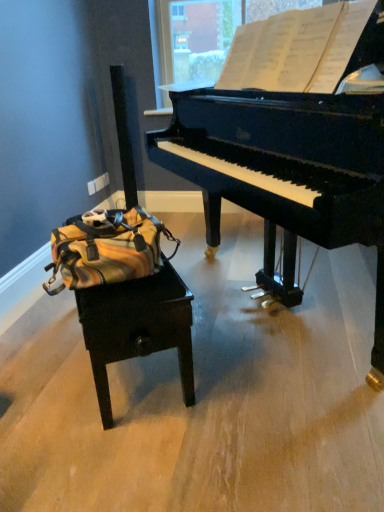
Question: Do you think black polished piano at upper right is within yellow striped fabric messenger bag at left, or outside of it?

Choices:
 (A) outside
 (B) inside

Answer: (A)

Question: Considering the positions of black polished piano at upper right and yellow striped fabric messenger bag at left in the image, is black polished piano at upper right taller or shorter than yellow striped fabric messenger bag at left?

Choices:
 (A) tall
 (B) short

Answer: (A)

Question: Which object is positioned farthest from the wooden table at lower left?

Choices:
 (A) yellow striped fabric messenger bag at left
 (B) white paper at upper center
 (C) black polished piano at upper right

Answer: (B)

Question: Which of these objects is positioned closest to the black polished piano at upper right?

Choices:
 (A) yellow striped fabric messenger bag at left
 (B) white paper at upper center
 (C) wooden table at lower left

Answer: (B)